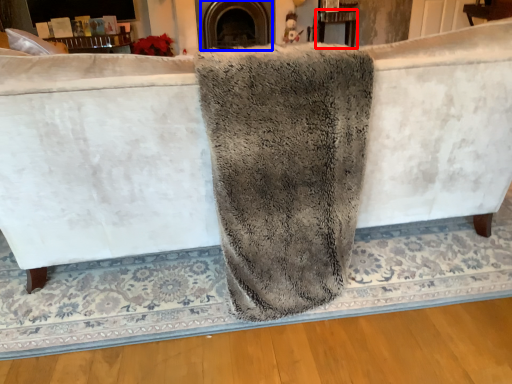
Question: Among these objects, which one is nearest to the camera, table (highlighted by a red box) or fireplace (highlighted by a blue box)?

Choices:
 (A) table
 (B) fireplace

Answer: (B)